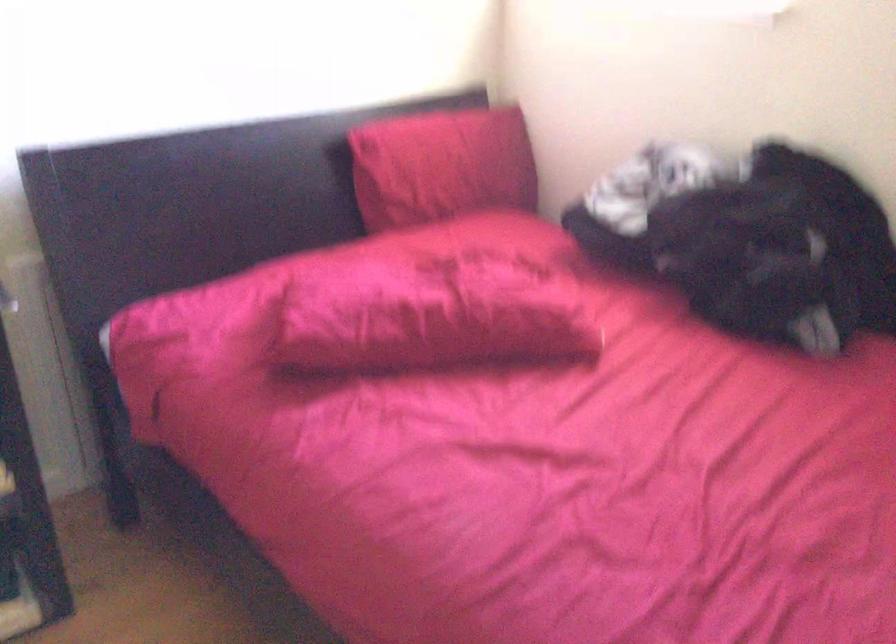
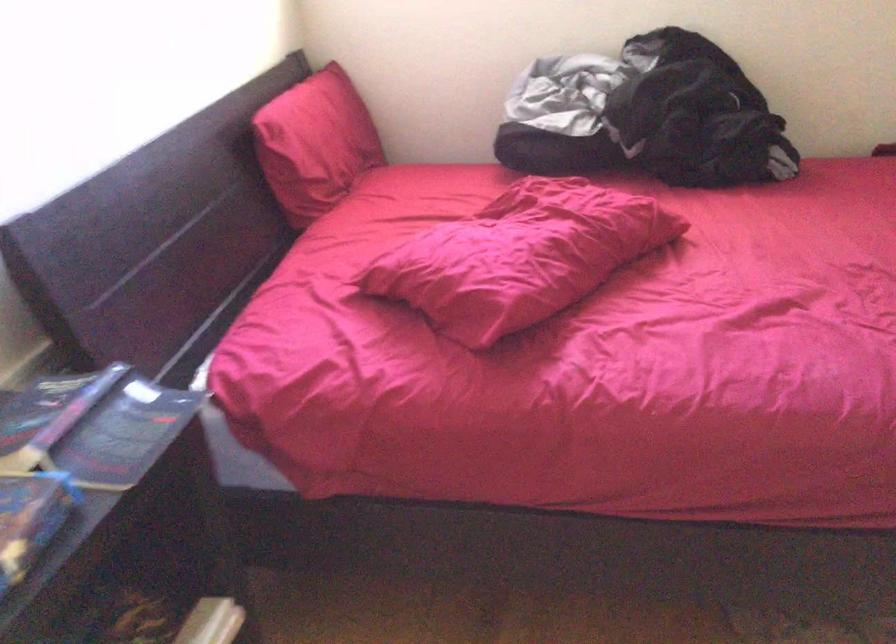
Find the pixel in the second image that matches the point at 356,306 in the first image.

(520, 257)